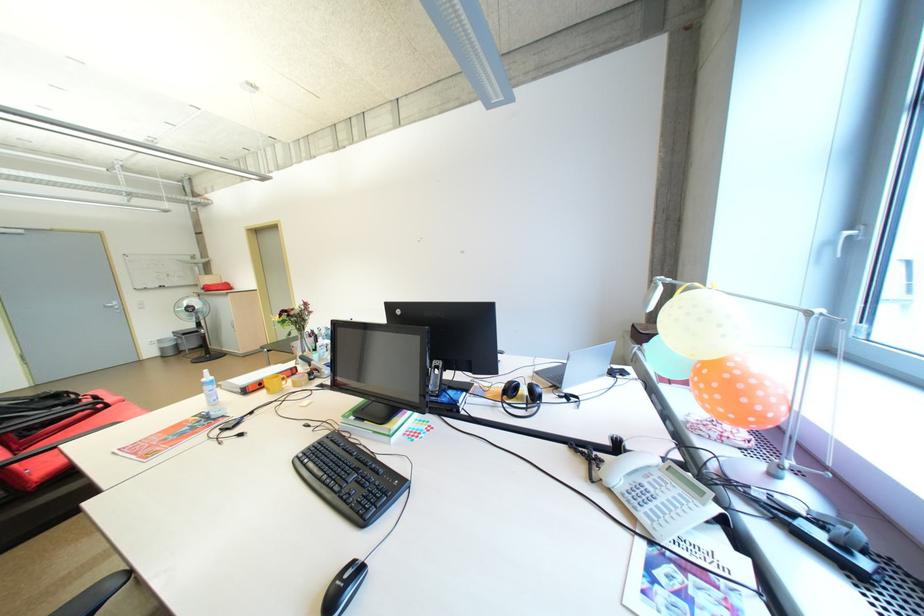
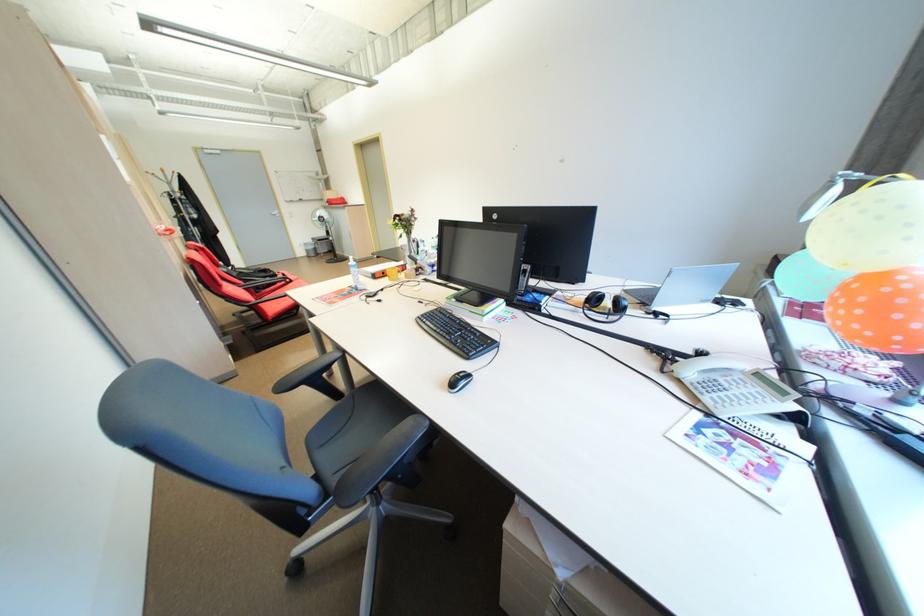
Find the pixel in the second image that matches pixel 710 320 in the first image.

(889, 219)